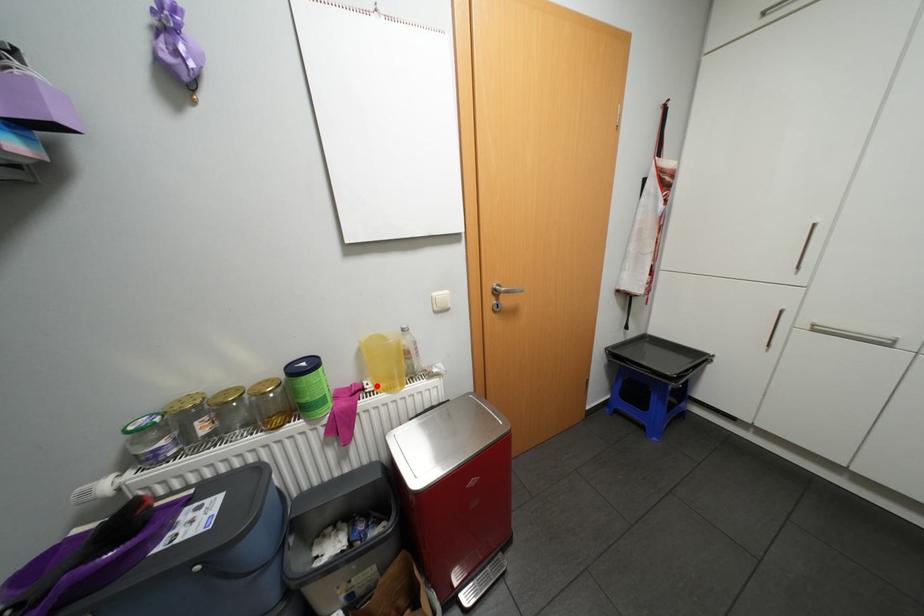
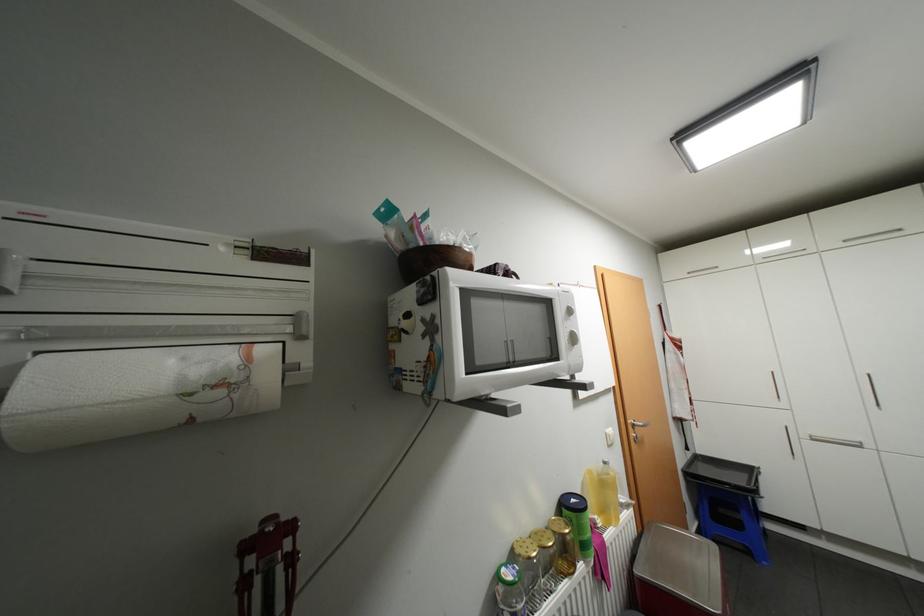
Question: I am providing you with two images of the same scene from different viewpoints. Image1 has a red point marked. In image2, the corresponding 3D location appears at what relative position? Reply with the corresponding letter.

Choices:
 (A) Closer
 (B) Farther

Answer: (B)